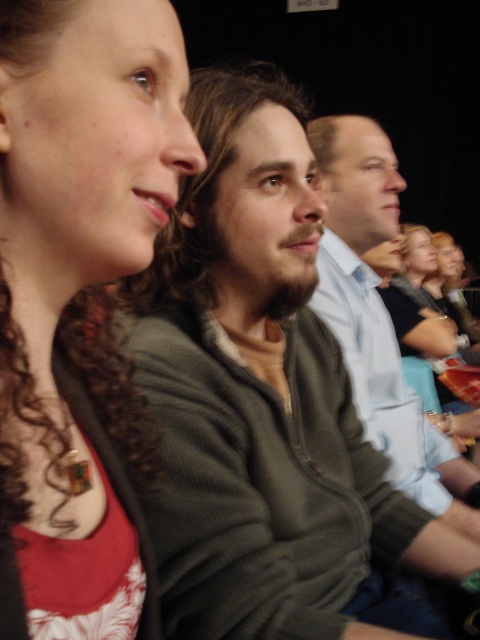
Question: Can you confirm if dark green sweater at center is positioned below light blue shirt at center?

Choices:
 (A) no
 (B) yes

Answer: (B)

Question: Does matte green sweater at upper left appear over light blue shirt at center?

Choices:
 (A) yes
 (B) no

Answer: (B)

Question: Which object is positioned farthest from the dark green sweater at center?

Choices:
 (A) matte green sweater at upper left
 (B) light blue shirt at center

Answer: (B)

Question: Which object is closer to the camera taking this photo?

Choices:
 (A) dark green sweater at center
 (B) light blue shirt at center
 (C) matte green sweater at upper left

Answer: (C)

Question: Which point appears farthest from the camera in this image?

Choices:
 (A) (393, 403)
 (B) (200, 92)

Answer: (A)

Question: Is matte green sweater at upper left bigger than light blue shirt at center?

Choices:
 (A) no
 (B) yes

Answer: (A)